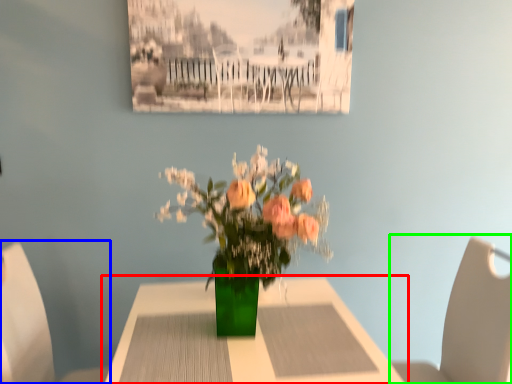
Question: Which object is the farthest from table (highlighted by a red box)? Choose among these: chair (highlighted by a blue box) or chair (highlighted by a green box).

Choices:
 (A) chair
 (B) chair

Answer: (B)